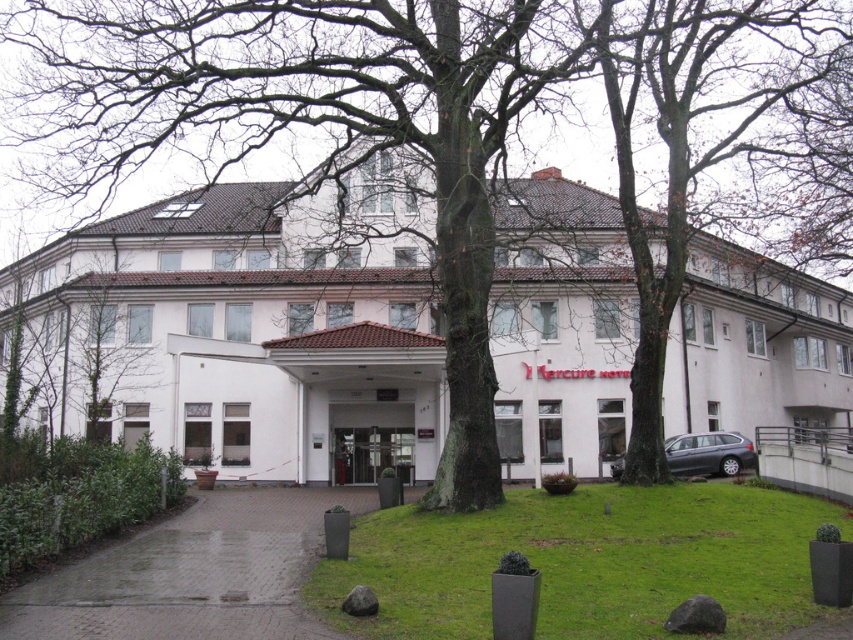
Question: Which object is positioned farthest from the metallic gray car at lower right?

Choices:
 (A) smooth bark tree at center
 (B) white matte building at center

Answer: (B)

Question: Which point appears farthest from the camera in this image?

Choices:
 (A) (618, 35)
 (B) (283, 289)

Answer: (B)

Question: Which is nearer to the smooth bark tree at center?

Choices:
 (A) white matte building at center
 (B) metallic gray car at lower right

Answer: (A)

Question: Does white matte building at center have a greater width compared to metallic gray car at lower right?

Choices:
 (A) no
 (B) yes

Answer: (B)

Question: Can you confirm if white matte building at center is positioned below metallic gray car at lower right?

Choices:
 (A) no
 (B) yes

Answer: (A)

Question: Where is white matte building at center located in relation to metallic gray car at lower right in the image?

Choices:
 (A) left
 (B) right

Answer: (A)